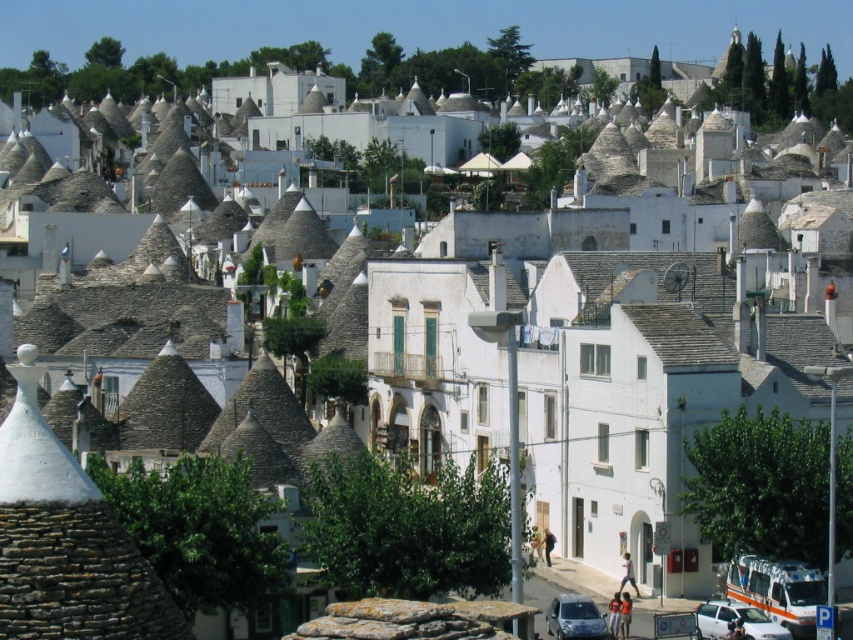
Which is above, metallic silver car at lower right or silver metallic hatchback at lower center?

silver metallic hatchback at lower center is higher up.

Is point (755, 625) positioned before point (575, 636)?

Yes.

Identify the location of metallic silver car at lower right. (735, 620).

This screenshot has width=853, height=640. I want to click on metallic silver car at lower right, so click(x=735, y=620).